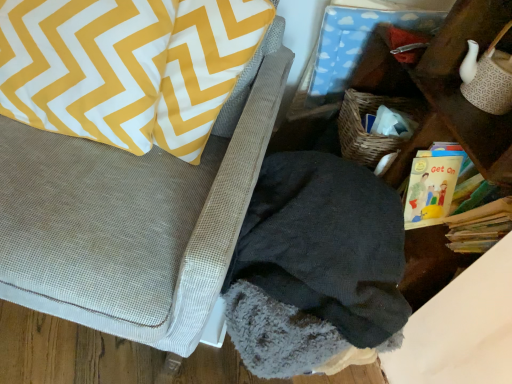
Question: Can you confirm if yellow/white zigzag pillow at upper left is wider than yellow paper book at right?

Choices:
 (A) yes
 (B) no

Answer: (B)

Question: From a real-world perspective, is yellow/white zigzag pillow at upper left physically above yellow paper book at right?

Choices:
 (A) no
 (B) yes

Answer: (B)

Question: Is yellow/white zigzag pillow at upper left positioned far away from yellow paper book at right?

Choices:
 (A) yes
 (B) no

Answer: (B)

Question: Is yellow/white zigzag pillow at upper left outside of yellow paper book at right?

Choices:
 (A) yes
 (B) no

Answer: (A)

Question: Can yellow paper book at right be found inside yellow/white zigzag pillow at upper left?

Choices:
 (A) no
 (B) yes

Answer: (A)

Question: In the image, is fuzzy gray blanket at lower right positioned in front of or behind dark fleece blanket at lower right?

Choices:
 (A) behind
 (B) front

Answer: (B)

Question: Looking at the image, does fuzzy gray blanket at lower right seem bigger or smaller compared to dark fleece blanket at lower right?

Choices:
 (A) big
 (B) small

Answer: (A)

Question: Considering the positions of fuzzy gray blanket at lower right and dark fleece blanket at lower right in the image, is fuzzy gray blanket at lower right wider or thinner than dark fleece blanket at lower right?

Choices:
 (A) thin
 (B) wide

Answer: (B)

Question: From the image's perspective, is fuzzy gray blanket at lower right located above or below dark fleece blanket at lower right?

Choices:
 (A) above
 (B) below

Answer: (A)

Question: Considering their positions, is yellow/white zigzag pillow at upper left located in front of or behind yellow paper book at right?

Choices:
 (A) front
 (B) behind

Answer: (A)

Question: From the image's perspective, is yellow/white zigzag pillow at upper left located above or below yellow paper book at right?

Choices:
 (A) above
 (B) below

Answer: (A)

Question: From a real-world perspective, is yellow/white zigzag pillow at upper left above or below yellow paper book at right?

Choices:
 (A) below
 (B) above

Answer: (B)

Question: Based on their sizes in the image, would you say yellow/white zigzag pillow at upper left is bigger or smaller than yellow paper book at right?

Choices:
 (A) big
 (B) small

Answer: (A)

Question: In the image, is yellow paper book at right positioned in front of or behind dark fleece blanket at lower right?

Choices:
 (A) behind
 (B) front

Answer: (A)

Question: Is yellow paper book at right wider or thinner than dark fleece blanket at lower right?

Choices:
 (A) thin
 (B) wide

Answer: (A)